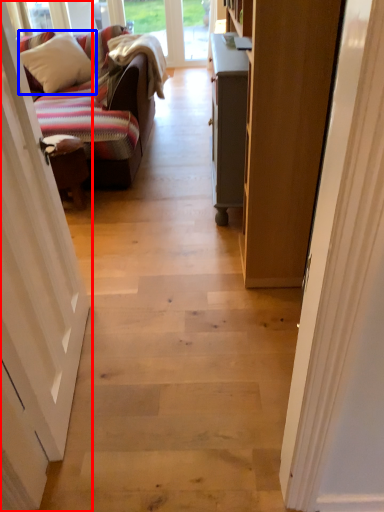
Question: Which object appears closest to the camera in this image, door (highlighted by a red box) or pillow (highlighted by a blue box)?

Choices:
 (A) door
 (B) pillow

Answer: (A)